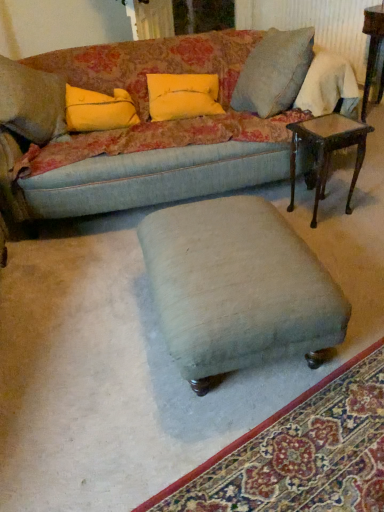
Where is `empty space that is ontop of velvet green ottoman at center (from a real-world perspective)`? The width and height of the screenshot is (384, 512). empty space that is ontop of velvet green ottoman at center (from a real-world perspective) is located at coordinates (308, 448).